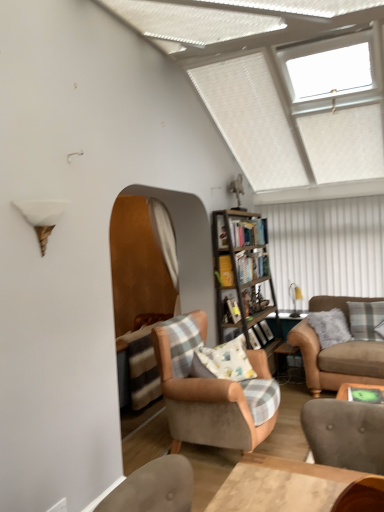
Question: Considering the positions of point (278, 368) and point (226, 348), is point (278, 368) closer or farther from the camera than point (226, 348)?

Choices:
 (A) closer
 (B) farther

Answer: (B)

Question: From a real-world perspective, relative to fluffy cotton pillow at center, which is the second pillow from right to left, is metallic silver side table at lower right vertically above or below?

Choices:
 (A) above
 (B) below

Answer: (B)

Question: Which object is the farthest from the green felt table at lower right?

Choices:
 (A) fluffy cotton pillow at center, the 1th pillow positioned from the front
 (B) suede brown couch at right
 (C) white plastic window at upper right
 (D) velvet beige armchair at center
 (E) orange fabric curtain at center

Answer: (C)

Question: Estimate the real-world distances between objects in this image. Which object is closer to the white plastic window at upper right?

Choices:
 (A) wooden bookshelf at center
 (B) orange fabric curtain at center
 (C) metallic silver side table at lower right
 (D) wooden bookshelf at center
 (E) gray plaid pillow at right, which ranks as the first pillow in back-to-front order

Answer: (A)